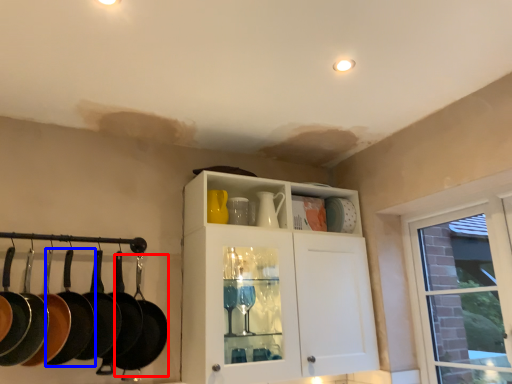
Question: Which object appears farthest to the camera in this image, frying pan (highlighted by a red box) or frying pan (highlighted by a blue box)?

Choices:
 (A) frying pan
 (B) frying pan

Answer: (A)